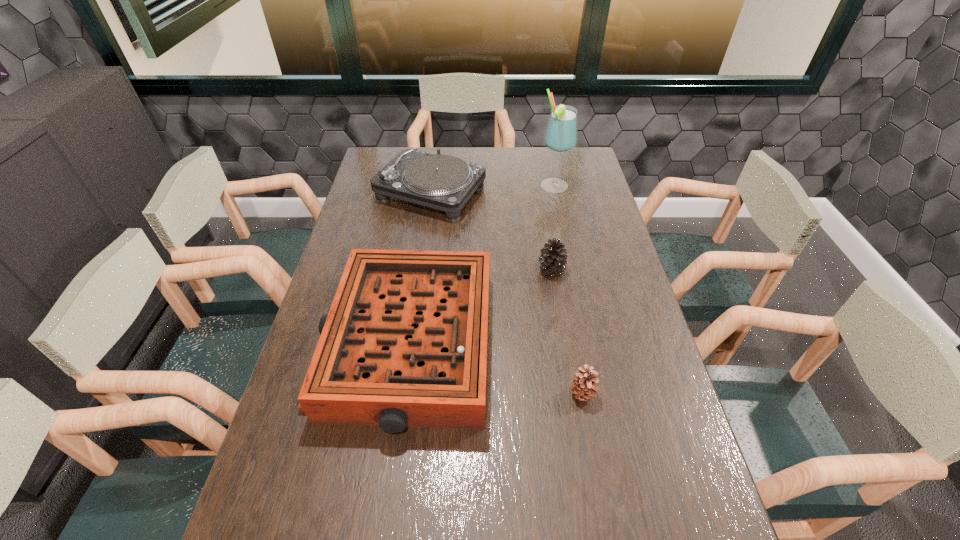
At what (x,y) coordinates should I click in order to perform the action: click on the tallest object. Please return your answer as a coordinate pair (x, y). This screenshot has width=960, height=540. Looking at the image, I should click on (561, 134).

I want to click on record player, so click(443, 182).

You are a GUI agent. You are given a task and a screenshot of the screen. Output one action in this format:
    pyautogui.click(x=<x>, y=<y>)
    Task: Click on the farther pinecone
    This screenshot has height=540, width=960.
    Given the screenshot: What is the action you would take?
    pyautogui.click(x=553, y=259)

You are a GUI agent. You are given a task and a screenshot of the screen. Output one action in this format:
    pyautogui.click(x=<x>, y=<y>)
    Task: Click on the gameboard
    The width and height of the screenshot is (960, 540).
    Given the screenshot: What is the action you would take?
    pyautogui.click(x=404, y=344)

Where is `the shorter pinecone`? the shorter pinecone is located at coordinates (583, 387).

I want to click on free spot located 0.150m on the back of the alcohol, so pos(547,158).

The height and width of the screenshot is (540, 960). Identify the location of vacant space located 0.330m on the right of the record player. (571, 192).

Locate an element on the screen. vacant space situated on the left of the farther pinecone is located at coordinates (506, 269).

Identify the location of free space located 0.230m on the right of the gameboard. Image resolution: width=960 pixels, height=540 pixels. (576, 345).

Where is `vacant space positioned on the left of the shorter pinecone`? This screenshot has width=960, height=540. vacant space positioned on the left of the shorter pinecone is located at coordinates (423, 394).